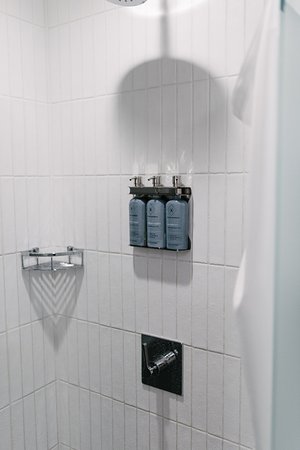
You are a GUI agent. You are given a task and a screenshot of the screen. Output one action in this format:
    pyautogui.click(x=<x>, y=<y>)
    Task: Click on the shower curtain
    Image resolution: width=300 pixels, height=450 pixels.
    Given the screenshot: What is the action you would take?
    pyautogui.click(x=251, y=319)